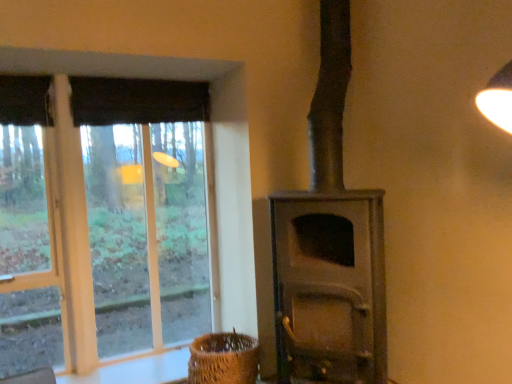
Question: From the image's perspective, is dark fabric curtain at upper left located above or below matte gray wood burning stove at center?

Choices:
 (A) above
 (B) below

Answer: (A)

Question: In terms of height, does dark fabric curtain at upper left look taller or shorter compared to matte gray wood burning stove at center?

Choices:
 (A) short
 (B) tall

Answer: (A)

Question: Estimate the real-world distances between objects in this image. Which object is farther from the dark fabric curtain at upper left?

Choices:
 (A) brown woven basket at lower center
 (B) clear glass window at left
 (C) matte gray wood burning stove at center

Answer: (A)

Question: Which is farther from the clear glass window at left?

Choices:
 (A) brown woven basket at lower center
 (B) dark fabric curtain at upper left
 (C) matte gray wood burning stove at center

Answer: (C)